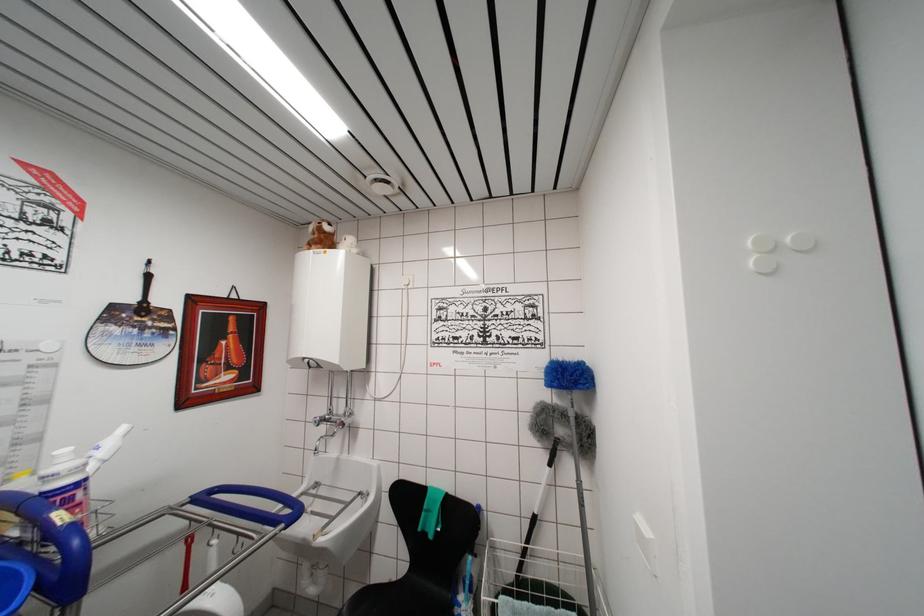
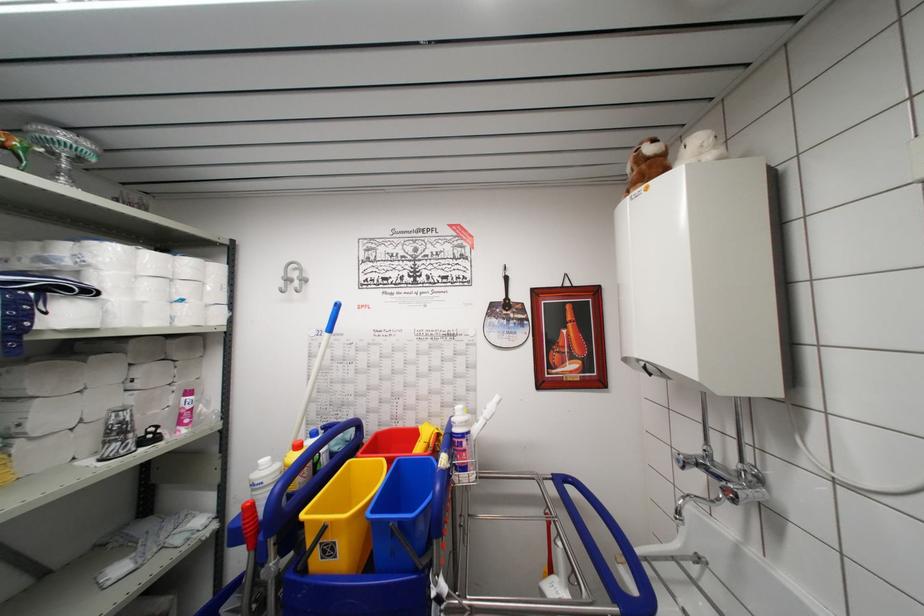
Locate, in the second image, the point that corresponds to pixel 320 455 in the first image.

(681, 517)